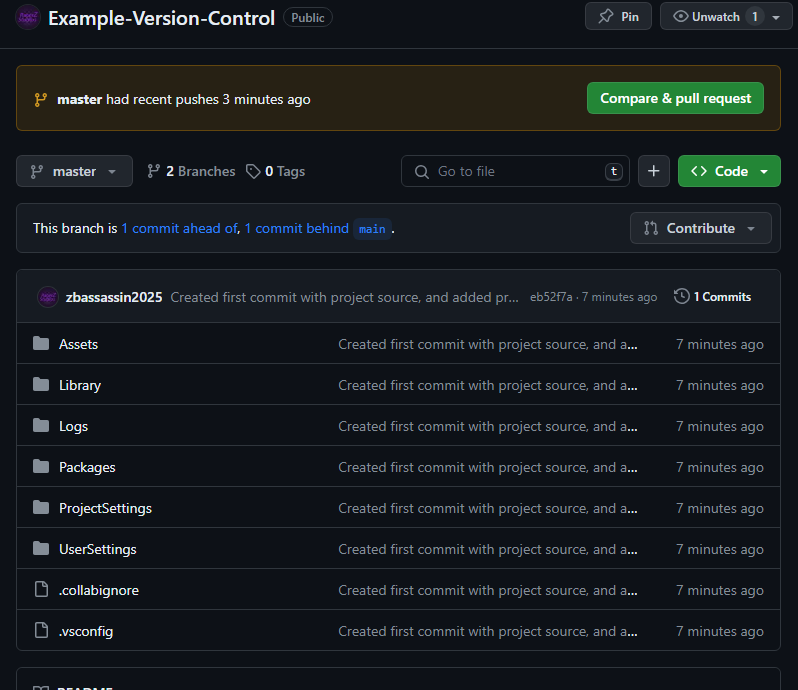
You are a GUI agent. You are given a task and a screenshot of the screen. Output one action in this format:
    pyautogui.click(x=<x>, y=<y>)
    Task: Click on the folders
    This screenshot has height=690, width=798.
    Given the screenshot: What is the action you would take?
    pyautogui.click(x=41, y=344), pyautogui.click(x=41, y=388), pyautogui.click(x=41, y=424), pyautogui.click(x=41, y=464), pyautogui.click(x=41, y=506), pyautogui.click(x=41, y=544)